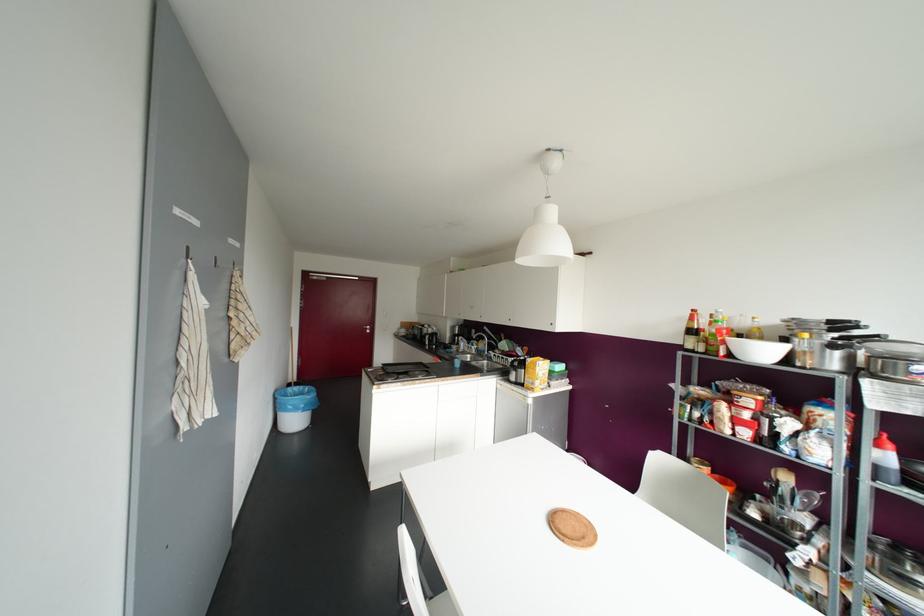
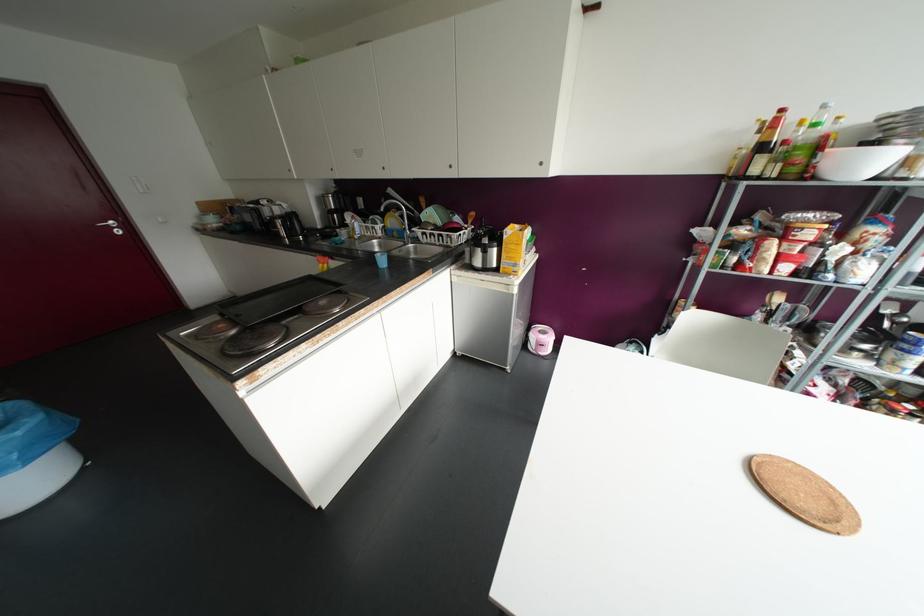
In the second image, find the point that corresponds to point (491, 353) in the first image.

(417, 231)